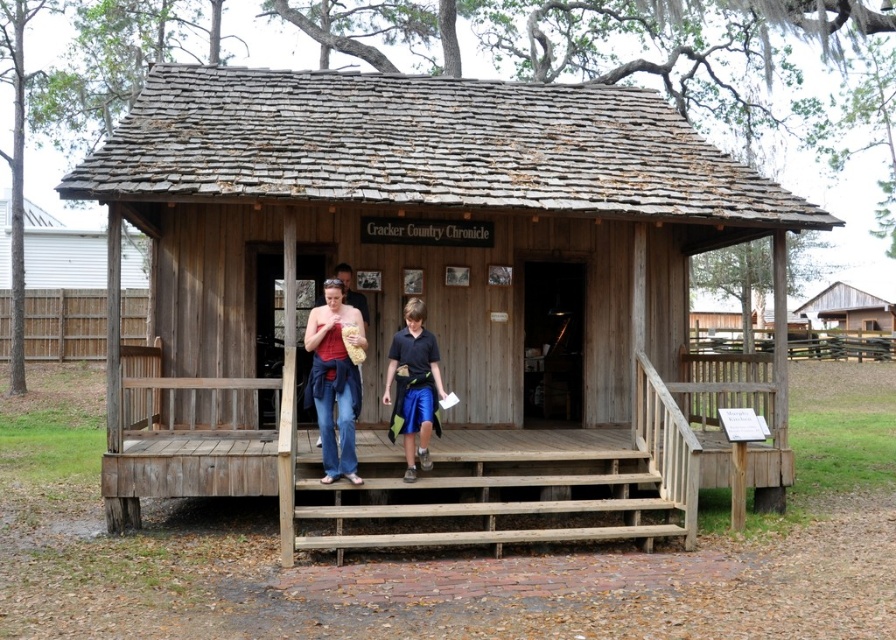
You are standing in a historical park and see the wooden log cabin at center. If you want to take a closer look, how many steps would you need to take to reach it if each of your steps covers about 0.75 meters?

The wooden log cabin at center is 6.66 meters away. Since each step covers 0.75 meters, dividing 6.66 by 0.75 gives approximately 8.88 steps. You would need to take around 9 steps to reach it.